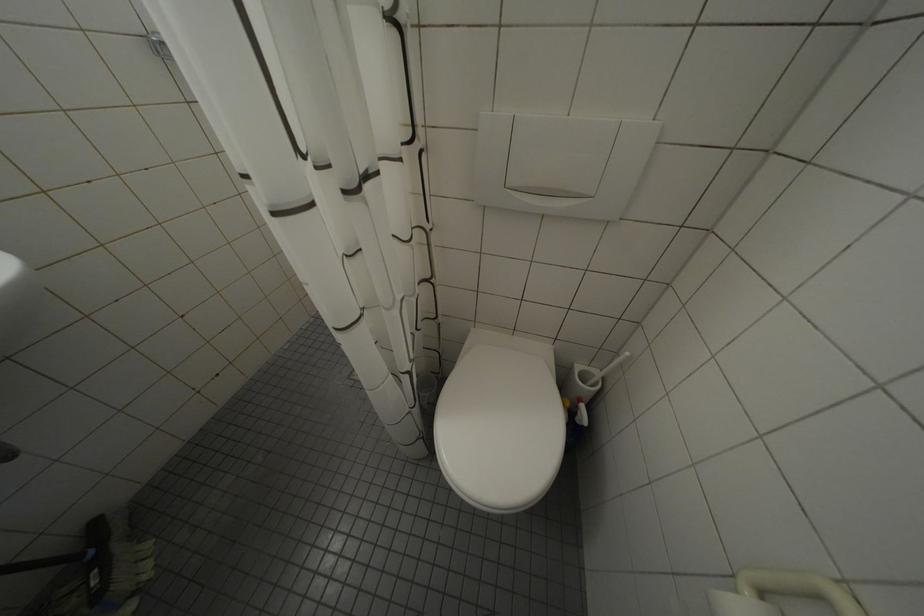
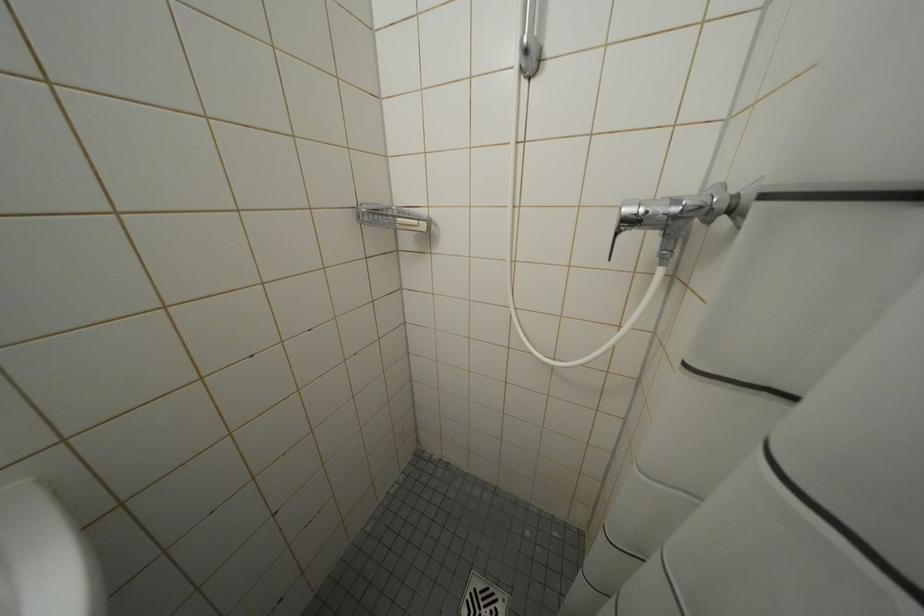
Question: The first image is from the beginning of the video and the second image is from the end. How did the camera likely rotate when shooting the video?

Choices:
 (A) Left
 (B) Right
 (C) Up
 (D) Down

Answer: (C)